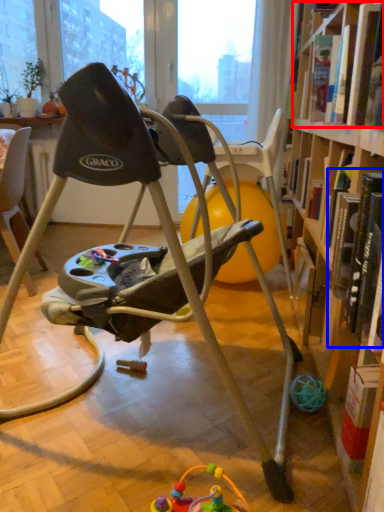
Question: Which object is further to the camera taking this photo, book (highlighted by a red box) or book (highlighted by a blue box)?

Choices:
 (A) book
 (B) book

Answer: (A)